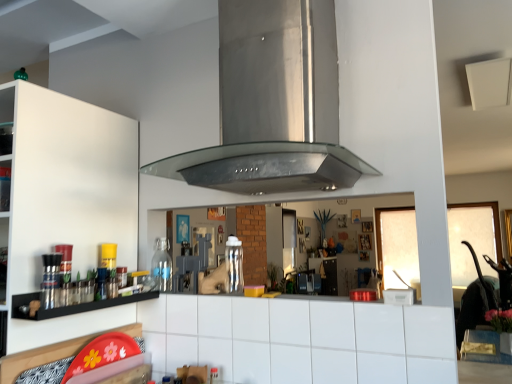
Question: Is clear plastic bottle at center, marked as the 2th bottle in a back-to-front arrangement, beside white tile counter at center?

Choices:
 (A) no
 (B) yes

Answer: (A)

Question: Does clear plastic bottle at center, which ranks as the 1th bottle in right-to-left order, appear on the left side of white tile counter at center?

Choices:
 (A) no
 (B) yes

Answer: (B)

Question: From the image's perspective, is clear plastic bottle at center, which ranks as the 1th bottle in right-to-left order, below white tile counter at center?

Choices:
 (A) yes
 (B) no

Answer: (B)

Question: Is clear plastic bottle at center, the first bottle viewed from the front, outside white tile counter at center?

Choices:
 (A) no
 (B) yes

Answer: (B)

Question: Would you say clear plastic bottle at center, arranged as the second bottle when viewed from the left, contains white tile counter at center?

Choices:
 (A) yes
 (B) no

Answer: (B)

Question: From the image's perspective, is clear plastic bottle at center, the first bottle viewed from the front, located above white tile counter at center?

Choices:
 (A) no
 (B) yes

Answer: (B)

Question: From the image's perspective, is black glass shelf at left under white tile counter at center?

Choices:
 (A) yes
 (B) no

Answer: (B)

Question: Are black glass shelf at left and white tile counter at center located far from each other?

Choices:
 (A) no
 (B) yes

Answer: (A)

Question: Does black glass shelf at left have a smaller size compared to white tile counter at center?

Choices:
 (A) no
 (B) yes

Answer: (B)

Question: Does black glass shelf at left turn towards white tile counter at center?

Choices:
 (A) no
 (B) yes

Answer: (A)

Question: From a real-world perspective, is black glass shelf at left below white tile counter at center?

Choices:
 (A) yes
 (B) no

Answer: (B)

Question: Can you confirm if black glass shelf at left is bigger than white tile counter at center?

Choices:
 (A) yes
 (B) no

Answer: (B)

Question: Is transparent glass bottle at left, the 1th bottle from the left, outside white matte cabinet at left?

Choices:
 (A) yes
 (B) no

Answer: (A)